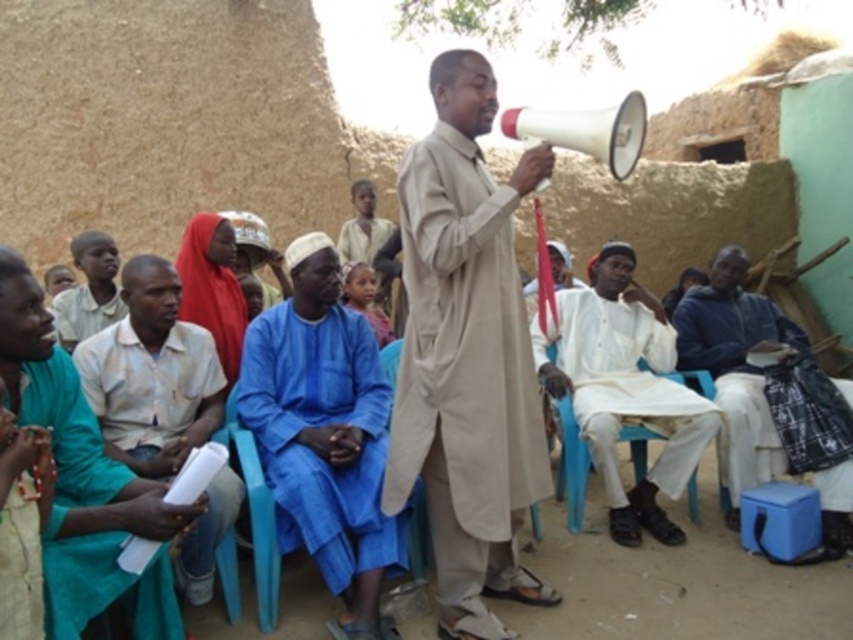
Who is more forward, (426,202) or (222,314)?

Point (426,202) is more forward.

Between point (471, 186) and point (184, 257), which one is positioned behind?

Point (184, 257)

The image size is (853, 640). Identify the location of beige fabric coat at center. (467, 356).

Is blue cotton shirt at center further to the viewer compared to white cotton shirt at center?

No, it is in front of white cotton shirt at center.

Between point (347, 413) and point (631, 332), which one is positioned behind?

Positioned behind is point (631, 332).

Does point (305, 378) come in front of point (575, 396)?

Yes, it is.

Where is `blue cotton shirt at center`? blue cotton shirt at center is located at coordinates (323, 435).

In the scene shown: Who is higher up, beige fabric coat at center or teal fabric robe at lower left?

Positioned higher is beige fabric coat at center.

Is beige fabric coat at center smaller than teal fabric robe at lower left?

Actually, beige fabric coat at center might be larger than teal fabric robe at lower left.

Where is `beige fabric coat at center`? beige fabric coat at center is located at coordinates (467, 356).

Find the location of a particular element. Image resolution: width=853 pixels, height=640 pixels. beige fabric coat at center is located at coordinates (467, 356).